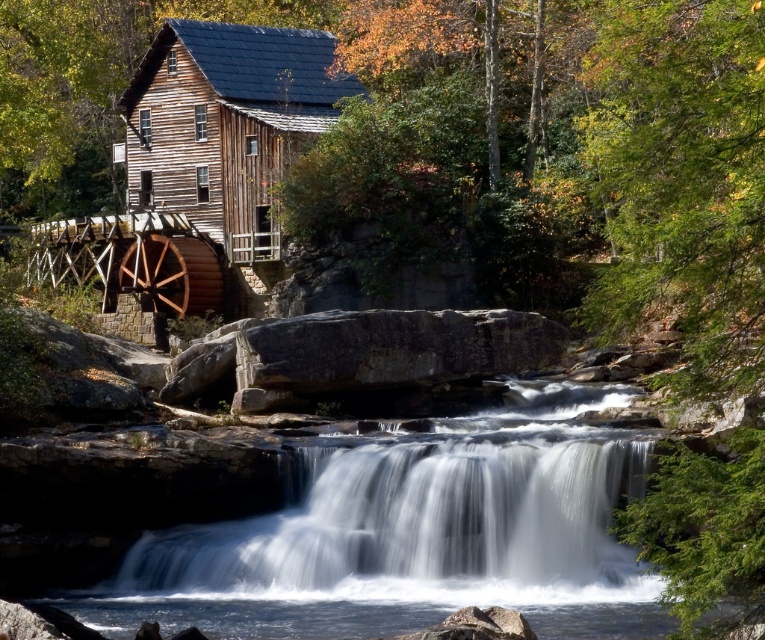
Is point (404, 518) more distant than point (151, 90)?

No, (404, 518) is closer to viewer.

Who is more distant from viewer, (487,532) or (347,92)?

Point (347,92)

Describe the element at coordinates (418, 529) in the screenshot. I see `white smooth waterfall at center` at that location.

I want to click on white smooth waterfall at center, so click(x=418, y=529).

Does white smooth water at center have a greater width compared to white smooth waterfall at center?

Yes, white smooth water at center is wider than white smooth waterfall at center.

Between white smooth water at center and white smooth waterfall at center, which one appears on the left side from the viewer's perspective?

Positioned to the left is white smooth waterfall at center.

The image size is (765, 640). In order to click on white smooth water at center in this screenshot , I will do `click(415, 534)`.

Between white smooth water at center and wooden cabin at center, which one has less height?

Standing shorter between the two is white smooth water at center.

Does point (601, 448) come farther from viewer compared to point (239, 84)?

That is False.

Find the location of a particular element. Image resolution: width=765 pixels, height=640 pixels. white smooth water at center is located at coordinates (415, 534).

The image size is (765, 640). What are the coordinates of `white smooth water at center` in the screenshot? It's located at (415, 534).